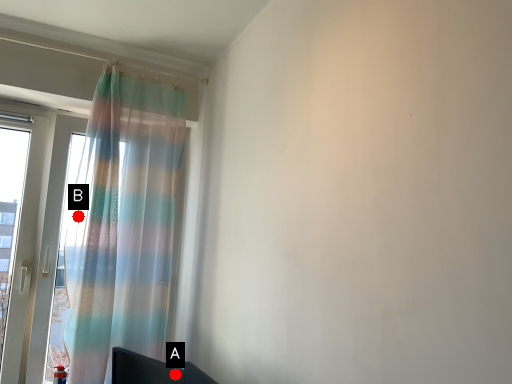
Question: Two points are circled on the image, labeled by A and B beside each circle. Which point appears closest to the camera in this image?

Choices:
 (A) A is closer
 (B) B is closer

Answer: (A)